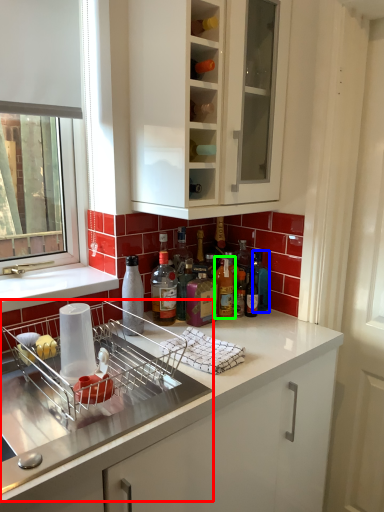
Question: Which is nearer to the dish washer (highlighted by a red box)? bottle (highlighted by a blue box) or bottle (highlighted by a green box).

Choices:
 (A) bottle
 (B) bottle

Answer: (B)